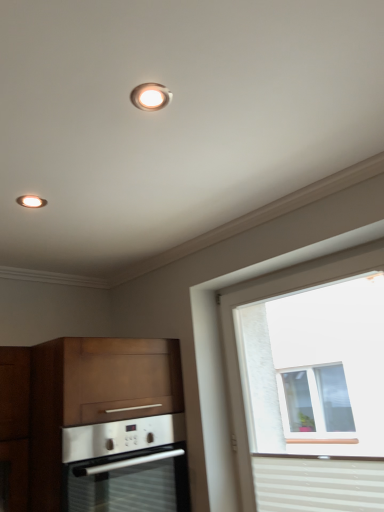
Question: From the image's perspective, relative to matte white recessed light at upper center, is satin silver oven at lower left above or below?

Choices:
 (A) below
 (B) above

Answer: (A)

Question: Relative to matte white recessed light at upper center, is satin silver oven at lower left in front or behind?

Choices:
 (A) behind
 (B) front

Answer: (A)

Question: Which object is positioned closest to the satin silver oven at lower left?

Choices:
 (A) matte white recessed light at upper center
 (B) wooden cabinet at lower left
 (C) white striped curtain at lower right
 (D) white textured window at right

Answer: (B)

Question: Estimate the real-world distances between objects in this image. Which object is closer to the wooden cabinet at lower left?

Choices:
 (A) white striped curtain at lower right
 (B) satin silver oven at lower left
 (C) matte white recessed light at upper center
 (D) white textured window at right

Answer: (B)